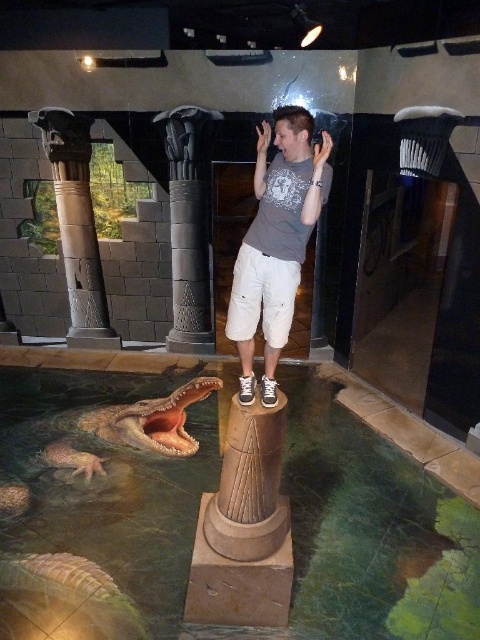
You are standing on the platform in the 3D art installation. You notice two points marked in the scene. Which point is closer to you, point (240,344) or point (73,330)?

Point (240,344) is closer to the viewer than point (73,330).